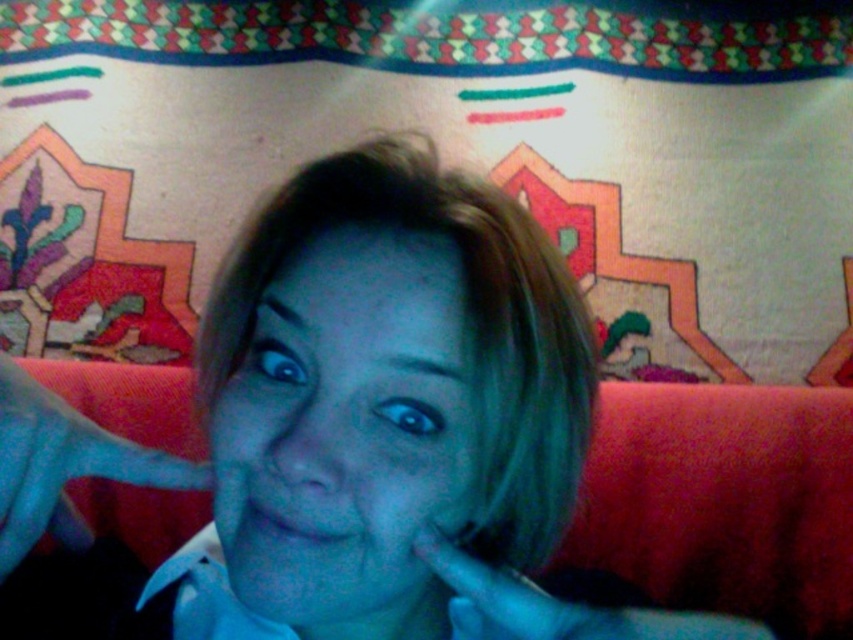
Who is positioned more to the left, matte blue face at center or blue fabric hand at center?

Positioned to the left is blue fabric hand at center.

Is matte blue face at center above blue fabric hand at center?

Incorrect, matte blue face at center is not positioned above blue fabric hand at center.

The image size is (853, 640). Identify the location of matte blue face at center. (358, 428).

Between matte blue face at center and smooth skin hand at lower right, which one appears on the left side from the viewer's perspective?

matte blue face at center

Does matte blue face at center appear on the left side of smooth skin hand at lower right?

Indeed, matte blue face at center is positioned on the left side of smooth skin hand at lower right.

Is point (212, 392) farther from camera compared to point (473, 579)?

Yes, point (212, 392) is farther from viewer.

Identify the location of matte blue face at center. Image resolution: width=853 pixels, height=640 pixels. pos(358,428).

Is point (9, 440) positioned after point (474, 600)?

No.

Does blue fabric hand at center have a larger size compared to smooth skin hand at lower right?

No, blue fabric hand at center is not bigger than smooth skin hand at lower right.

Find the location of `blue fabric hand at center`. blue fabric hand at center is located at coordinates (62, 464).

The height and width of the screenshot is (640, 853). I want to click on blue fabric hand at center, so click(x=62, y=464).